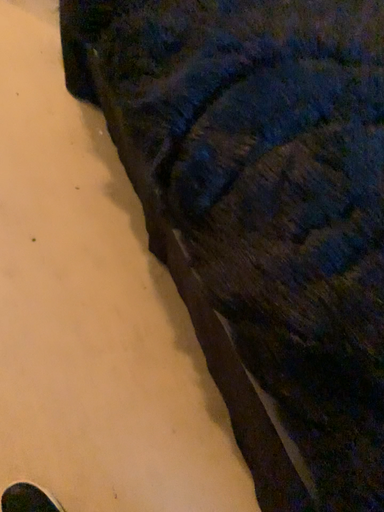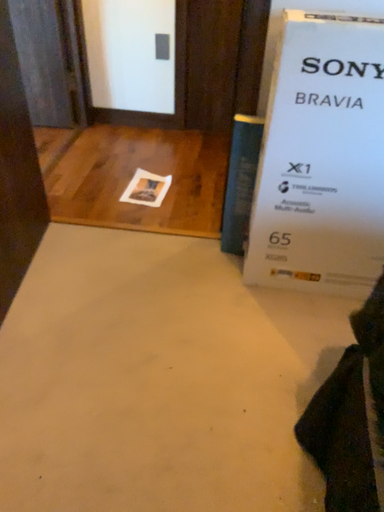
Question: How did the camera likely rotate when shooting the video?

Choices:
 (A) rotated left
 (B) rotated right

Answer: (A)